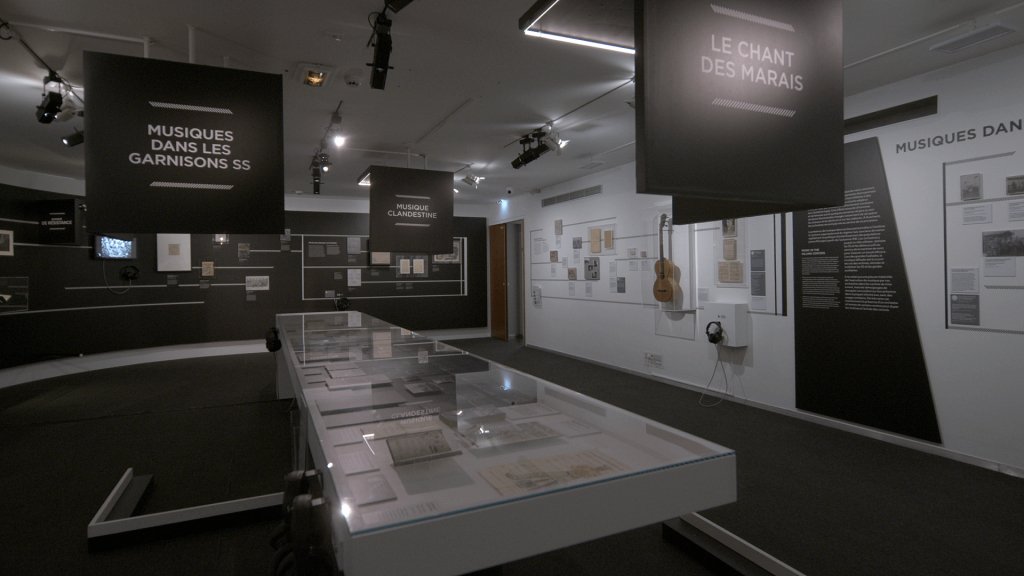
This screenshot has width=1024, height=576. What are the coordinates of `display table` in the screenshot? It's located at click(399, 394).